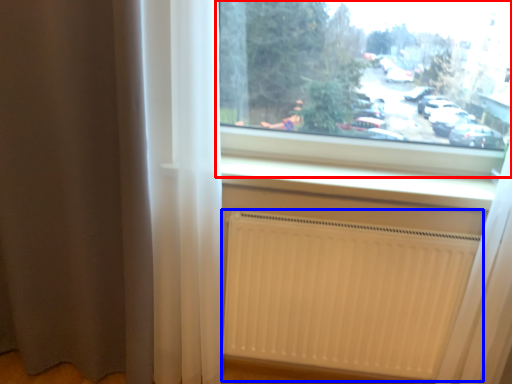
Question: Which point is further to the camera, window (highlighted by a red box) or radiator (highlighted by a blue box)?

Choices:
 (A) window
 (B) radiator

Answer: (B)